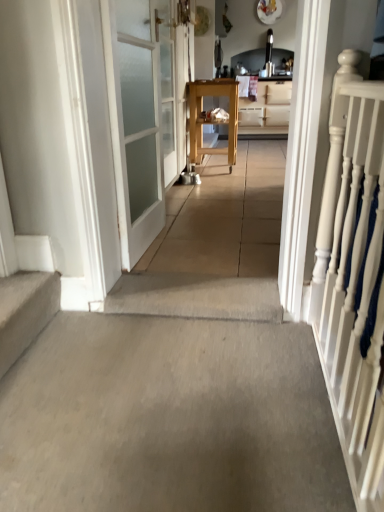
Question: Could you tell me if white painted wood railing at right is turned towards carpeted stairs at lower left?

Choices:
 (A) no
 (B) yes

Answer: (B)

Question: Would you say carpeted stairs at lower left is part of white painted wood railing at right's contents?

Choices:
 (A) no
 (B) yes

Answer: (A)

Question: Does white painted wood railing at right have a smaller size compared to carpeted stairs at lower left?

Choices:
 (A) yes
 (B) no

Answer: (B)

Question: Can you confirm if white painted wood railing at right is wider than carpeted stairs at lower left?

Choices:
 (A) yes
 (B) no

Answer: (A)

Question: Does white painted wood railing at right come in front of carpeted stairs at lower left?

Choices:
 (A) no
 (B) yes

Answer: (B)

Question: In terms of width, does wooden cabinet at center look wider or thinner when compared to wooden cart at center?

Choices:
 (A) thin
 (B) wide

Answer: (A)

Question: Would you say wooden cabinet at center is to the left or to the right of wooden cart at center in the picture?

Choices:
 (A) left
 (B) right

Answer: (B)

Question: From the image's perspective, is wooden cabinet at center positioned above or below wooden cart at center?

Choices:
 (A) below
 (B) above

Answer: (B)

Question: In the image, is wooden cabinet at center positioned in front of or behind wooden cart at center?

Choices:
 (A) front
 (B) behind

Answer: (B)

Question: Is clear glass door at center, marked as the 2th door in a front-to-back arrangement, taller or shorter than white painted wood railing at right?

Choices:
 (A) tall
 (B) short

Answer: (B)

Question: In terms of width, does clear glass door at center, marked as the 2th door in a front-to-back arrangement, look wider or thinner when compared to white painted wood railing at right?

Choices:
 (A) wide
 (B) thin

Answer: (B)

Question: Relative to white painted wood railing at right, is clear glass door at center, the 1th door from the back, in front or behind?

Choices:
 (A) behind
 (B) front

Answer: (A)

Question: From a real-world perspective, is clear glass door at center, marked as the 2th door in a front-to-back arrangement, above or below white painted wood railing at right?

Choices:
 (A) above
 (B) below

Answer: (A)

Question: Considering their positions, is wooden cabinet at center located in front of or behind white painted wood railing at right?

Choices:
 (A) front
 (B) behind

Answer: (B)

Question: Is wooden cabinet at center wider or thinner than white painted wood railing at right?

Choices:
 (A) wide
 (B) thin

Answer: (A)